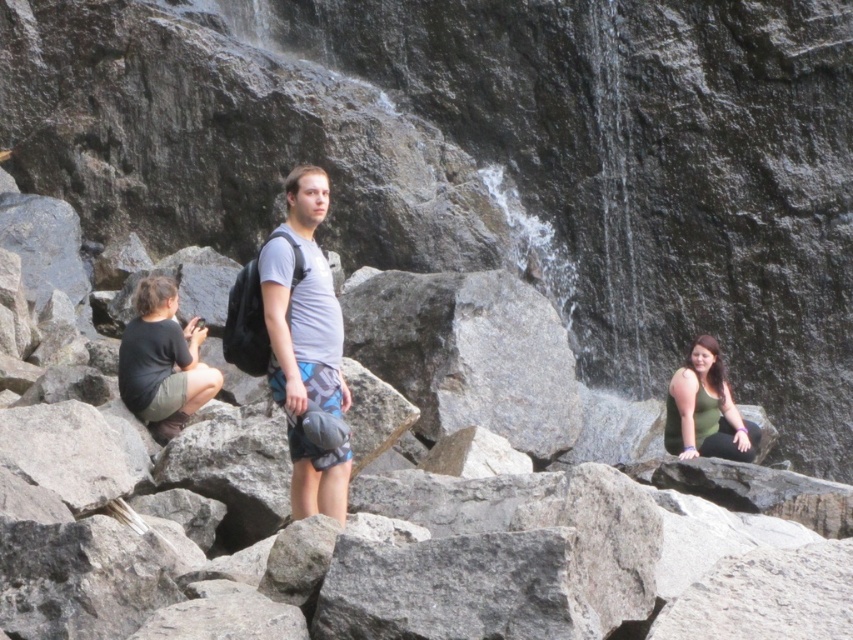
You are a hiker who needs to retrieve your black fabric at left from your gray fabric backpack at center. Can you reach it without moving from your current position?

The gray fabric backpack at center and black fabric at left are 6.41 meters apart, so you cannot reach the black fabric at left from the gray fabric backpack at center without moving.

You are a hiker who just arrived at the scene. You need to locate your gray fabric backpack at center. Where should you look?

You should look at point (306,344) to find the gray fabric backpack at center.